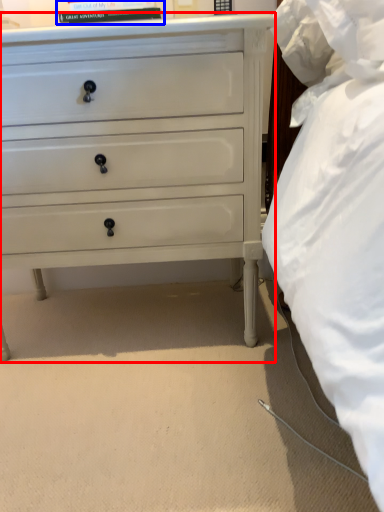
Question: Among these objects, which one is farthest to the camera, chest of drawers (highlighted by a red box) or book (highlighted by a blue box)?

Choices:
 (A) chest of drawers
 (B) book

Answer: (B)